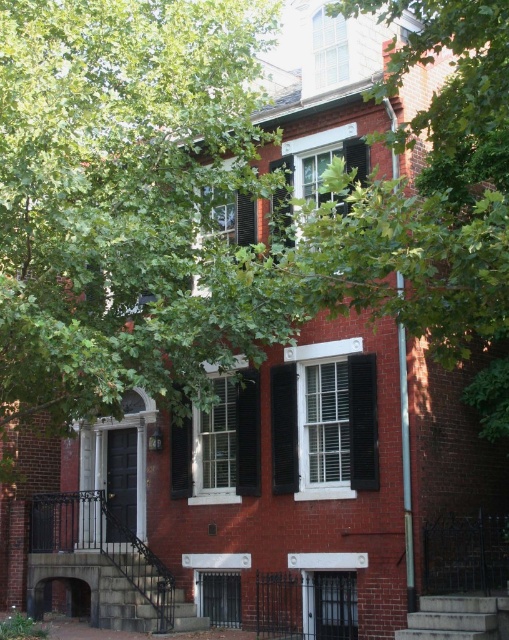
Question: Is matte black shutters at center in front of black wrought iron stairs at lower left?

Choices:
 (A) yes
 (B) no

Answer: (B)

Question: Where is matte black shutters at center located in relation to concrete stairs at lower right in the image?

Choices:
 (A) below
 (B) above

Answer: (B)

Question: Which object is farther from the camera taking this photo?

Choices:
 (A) matte black shutters at center
 (B) concrete stairs at lower right
 (C) black wrought iron stairs at lower left

Answer: (A)

Question: Can you confirm if matte black shutters at center is positioned to the left of concrete stairs at lower right?

Choices:
 (A) yes
 (B) no

Answer: (A)

Question: Estimate the real-world distances between objects in this image. Which object is farther from the black wrought iron stairs at lower left?

Choices:
 (A) black matte shutters at center
 (B) matte black shutters at center
 (C) concrete stairs at lower right

Answer: (C)

Question: Which object is positioned closest to the black wrought iron stairs at lower left?

Choices:
 (A) matte black shutters at center
 (B) black matte shutters at center
 (C) concrete stairs at lower right

Answer: (A)